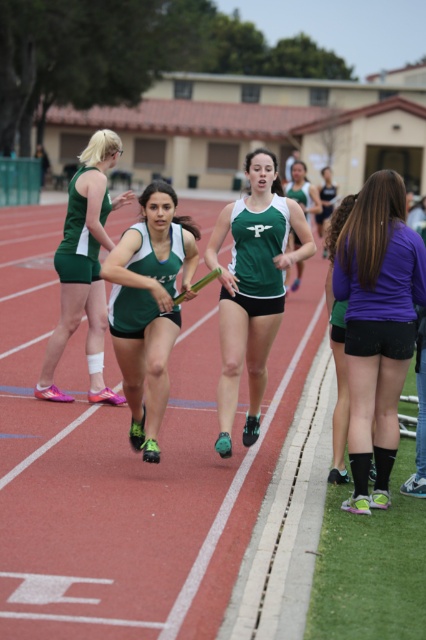
You are a coach observing the relay race. The team needs to ensure the baton exchange happens within a 10 meter zone. Based on the current positions of the green matte uniform at center and the purple matte shirt at center, will the exchange occur within the required zone?

The distance between the green matte uniform at center and the purple matte shirt at center is 4.22 meters, which is within the 10 meter zone. Therefore, the baton exchange will occur within the required zone.

You are a spectator at the relay race and want to know which runner is ahead in the race between the green matte uniform at center and the matte green uniform at center. Based on their positions, which runner is leading?

The green matte uniform at center is leading because it is positioned in front of the matte green uniform at center.